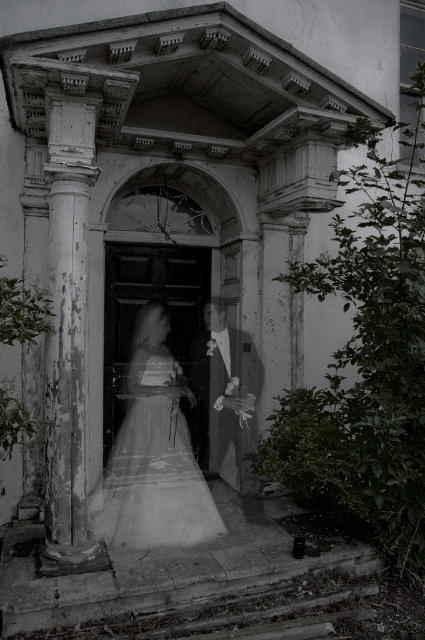
Who is lower down, weathered stone column at left or white tulle dress at center?

white tulle dress at center

This screenshot has height=640, width=425. What do you see at coordinates (68, 324) in the screenshot? I see `weathered stone column at left` at bounding box center [68, 324].

Locate an element on the screen. This screenshot has width=425, height=640. weathered stone column at left is located at coordinates (68, 324).

Does white tulle dress at center have a greater width compared to smooth white suit at center?

Yes, white tulle dress at center is wider than smooth white suit at center.

Which is in front, point (138, 515) or point (209, 301)?

Point (138, 515)

Which is in front, point (139, 440) or point (232, 396)?

Positioned in front is point (232, 396).

Locate an element on the screen. This screenshot has width=425, height=640. white tulle dress at center is located at coordinates (153, 468).

Is weathered stone column at left to the right of smooth white suit at center from the viewer's perspective?

No, weathered stone column at left is not to the right of smooth white suit at center.

Does weathered stone column at left have a smaller size compared to smooth white suit at center?

No, weathered stone column at left is not smaller than smooth white suit at center.

Is point (51, 349) less distant than point (215, 312)?

Yes, it is.

Find the location of a particular element. The width and height of the screenshot is (425, 640). weathered stone column at left is located at coordinates (68, 324).